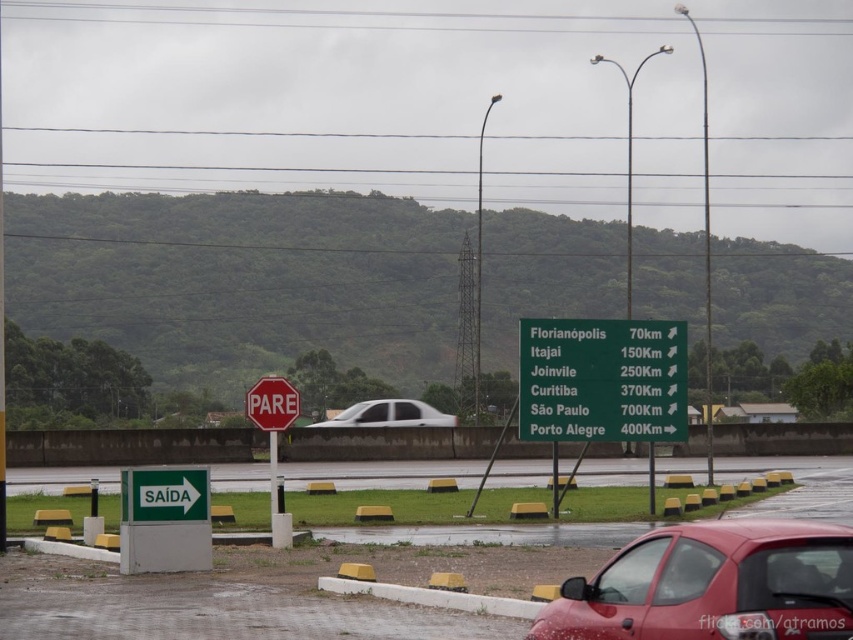
Between point (659, 566) and point (279, 426), which one is positioned in front?

Positioned in front is point (659, 566).

Who is positioned more to the left, shiny red car at lower right or red metal stop sign at center?

From the viewer's perspective, red metal stop sign at center appears more on the left side.

This screenshot has height=640, width=853. I want to click on shiny red car at lower right, so coord(712,586).

Is shiny red car at lower right thinner than white matte sedan at center?

Yes, shiny red car at lower right is thinner than white matte sedan at center.

Who is lower down, shiny red car at lower right or white matte sedan at center?

white matte sedan at center is lower down.

Describe the element at coordinates (712, 586) in the screenshot. I see `shiny red car at lower right` at that location.

At what (x,y) coordinates should I click in order to perform the action: click on shiny red car at lower right. Please return your answer as a coordinate pair (x, y). Looking at the image, I should click on (712, 586).

Can you confirm if shiny red car at lower right is positioned above green metallic sign at center?

Actually, shiny red car at lower right is below green metallic sign at center.

Which is above, shiny red car at lower right or green metallic sign at center?

Positioned higher is green metallic sign at center.

You are a GUI agent. You are given a task and a screenshot of the screen. Output one action in this format:
    pyautogui.click(x=<x>, y=<y>)
    Task: Click on the shiny red car at lower right
    This screenshot has height=640, width=853.
    Given the screenshot: What is the action you would take?
    pyautogui.click(x=712, y=586)